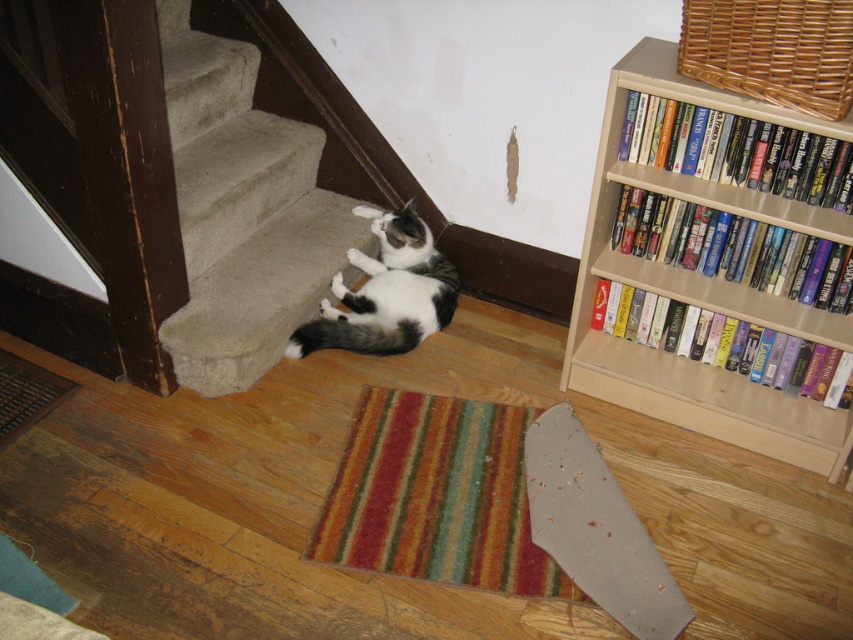
Does carpeted stairs at lower left lie behind beige wood bookcase at upper right?

Yes, it is behind beige wood bookcase at upper right.

Between carpeted stairs at lower left and beige wood bookcase at upper right, which one appears on the left side from the viewer's perspective?

carpeted stairs at lower left

Who is more forward, [199,253] or [718,394]?

Positioned in front is point [718,394].

This screenshot has width=853, height=640. Find the location of `carpeted stairs at lower left`. carpeted stairs at lower left is located at coordinates (242, 209).

In the scene shown: Who is positioned more to the left, carpeted stairs at lower left or black and white fur cat at lower center?

carpeted stairs at lower left

What do you see at coordinates (242, 209) in the screenshot? I see `carpeted stairs at lower left` at bounding box center [242, 209].

Where is `carpeted stairs at lower left`? The image size is (853, 640). carpeted stairs at lower left is located at coordinates (242, 209).

Does beige wood bookcase at upper right have a greater width compared to black and white fur cat at lower center?

Correct, the width of beige wood bookcase at upper right exceeds that of black and white fur cat at lower center.

Based on the photo, who is more distant from viewer, (659, 381) or (456, 296)?

The point (456, 296) is behind.

The height and width of the screenshot is (640, 853). Find the location of `beige wood bookcase at upper right`. beige wood bookcase at upper right is located at coordinates (701, 289).